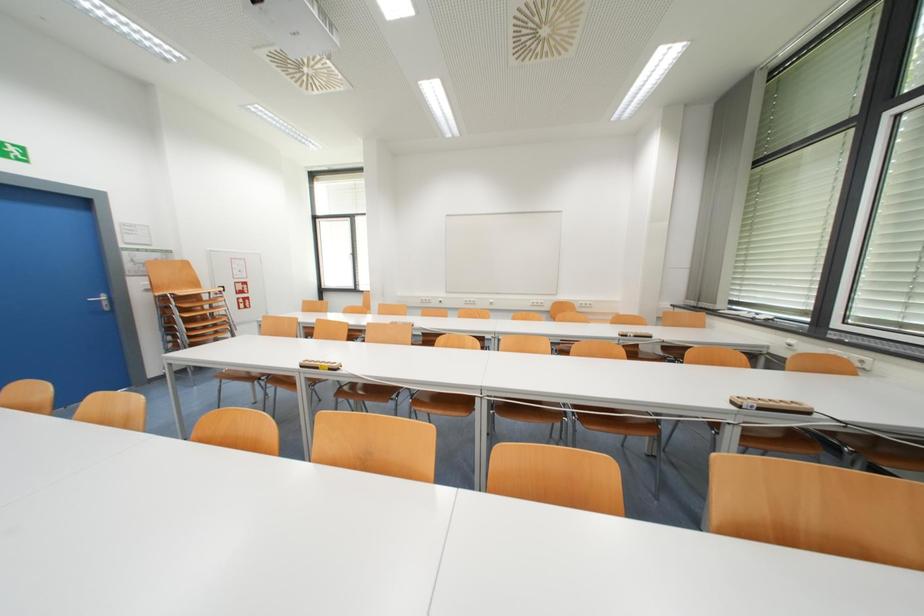
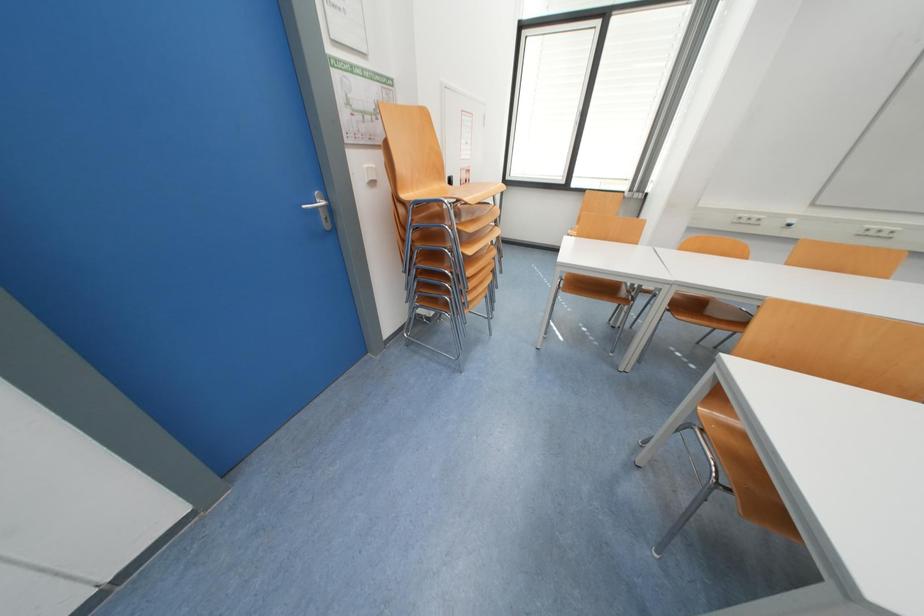
Which direction would the cameraman need to move to produce the second image?

The cameraman moved toward left, forward.